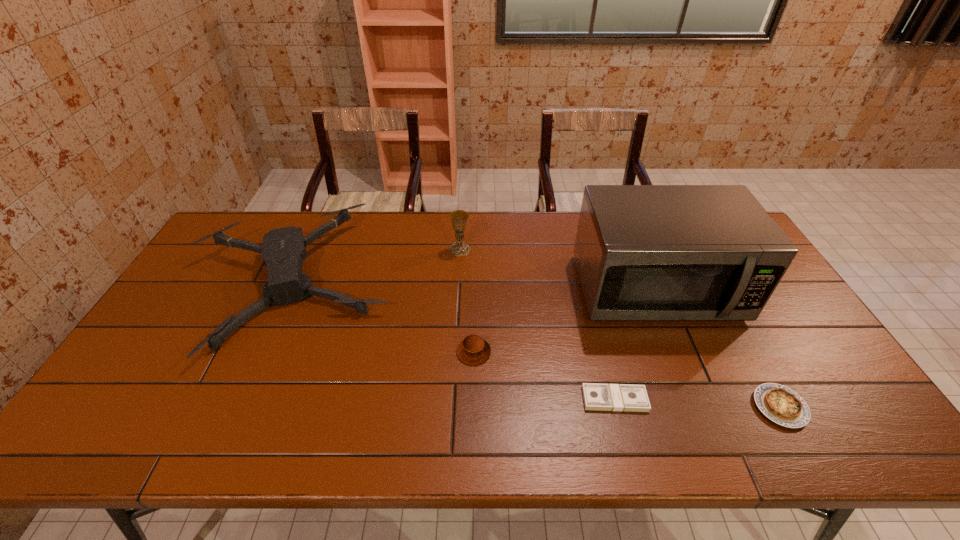
You are a GUI agent. You are given a task and a screenshot of the screen. Output one action in this format:
    pyautogui.click(x=<x>, y=<y>)
    Task: Click on the vacant area between the third tallest object and the fifth shortest object
    This screenshot has height=540, width=960.
    Given the screenshot: What is the action you would take?
    pyautogui.click(x=376, y=267)

At what (x,y) coordinates should I click in order to perform the action: click on free area in between the chalice and the drone. Please return your answer as a coordinate pair (x, y). The image size is (960, 540). Looking at the image, I should click on (376, 267).

Where is `free space between the quiche and the second tallest object`? free space between the quiche and the second tallest object is located at coordinates (620, 328).

This screenshot has height=540, width=960. In order to click on vacant space in between the microwave oven and the quiche in this screenshot , I will do `click(718, 348)`.

At what (x,y) coordinates should I click in order to perform the action: click on object that stands as the fourth closest to the chalice. Please return your answer as a coordinate pair (x, y). This screenshot has width=960, height=540. Looking at the image, I should click on (604, 397).

Where is `the third closest object to the chalice`? This screenshot has width=960, height=540. the third closest object to the chalice is located at coordinates (473, 350).

Where is `blank area in the image that satisfies the following two spatial constraints: 1. on the front-facing side of the fifth tallest object; 2. on the left side of the microwave oven`? blank area in the image that satisfies the following two spatial constraints: 1. on the front-facing side of the fifth tallest object; 2. on the left side of the microwave oven is located at coordinates (705, 407).